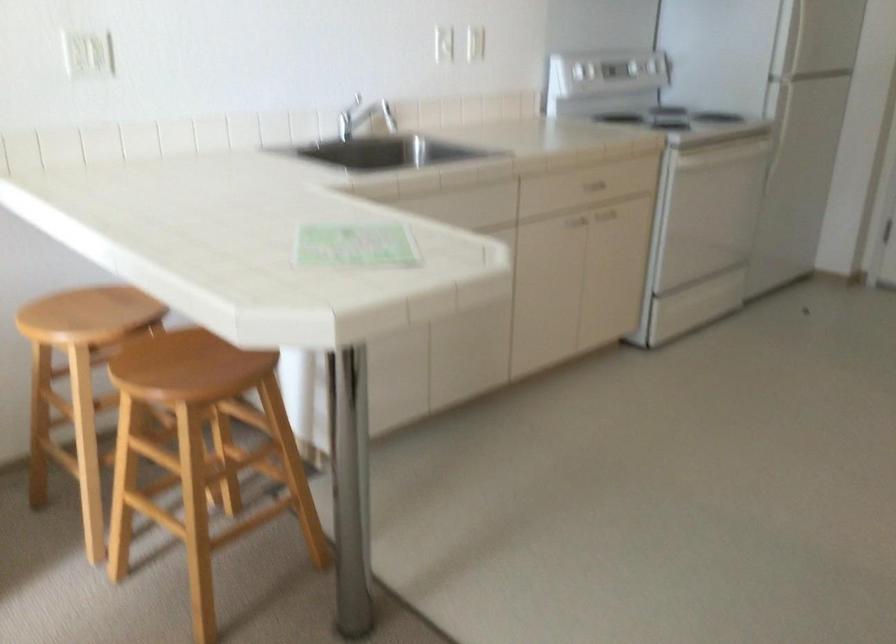
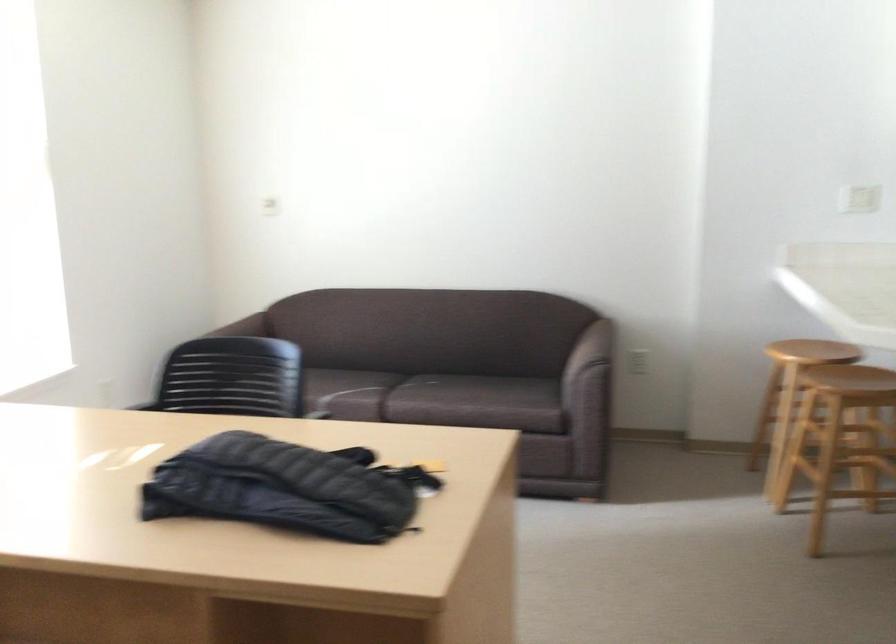
In the second image, find the point that corresponds to (74,413) in the first image.

(789, 395)